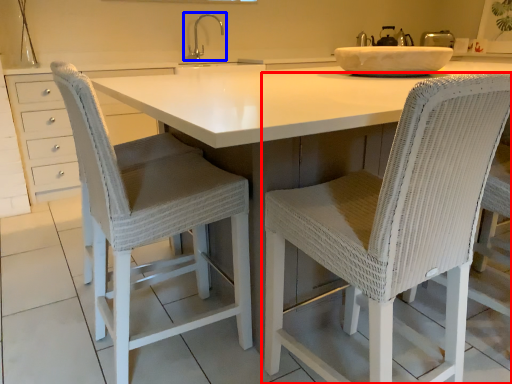
Question: Which object is closer to the camera taking this photo, chair (highlighted by a red box) or tap (highlighted by a blue box)?

Choices:
 (A) chair
 (B) tap

Answer: (A)